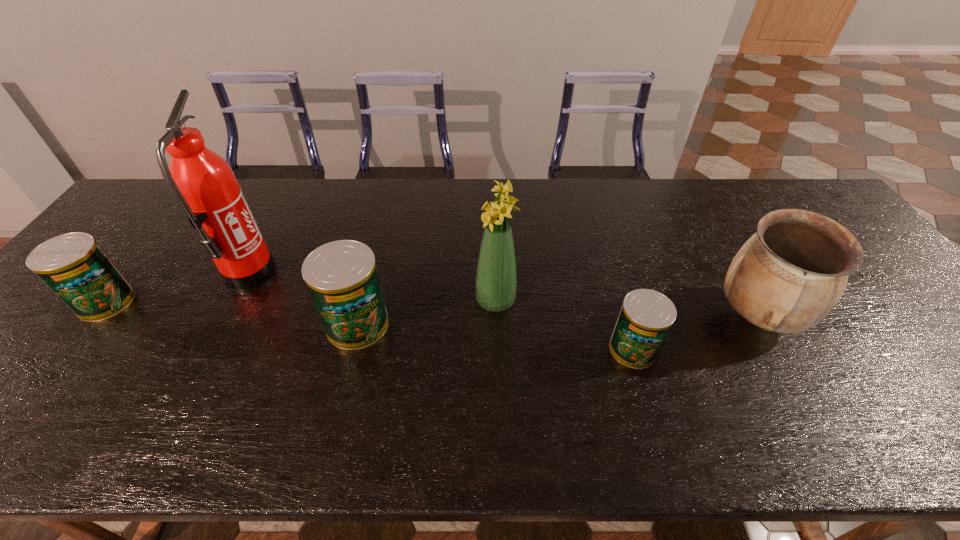
The height and width of the screenshot is (540, 960). What are the coordinates of `vacant space in between the third object from right to left and the second tallest can` in the screenshot? It's located at (301, 301).

Identify the location of free spot between the tallest object and the fifth object from left to right. Image resolution: width=960 pixels, height=540 pixels. (441, 310).

Point out which object is positioned as the nearest to the urn. Please provide its 2D coordinates. Your answer should be formatted as a tuple, i.e. [(x, y)], where the tuple contains the x and y coordinates of a point satisfying the conditions above.

[(646, 316)]

Identify which object is located as the fourth nearest to the rightmost can. Please provide its 2D coordinates. Your answer should be formatted as a tuple, i.e. [(x, y)], where the tuple contains the x and y coordinates of a point satisfying the conditions above.

[(203, 183)]

At what (x,y) coordinates should I click in order to perform the action: click on can that is the third closest to the fourth shortest object. Please return your answer as a coordinate pair (x, y). Image resolution: width=960 pixels, height=540 pixels. Looking at the image, I should click on (76, 269).

I want to click on can that is the nearest to the second shortest can, so click(x=342, y=278).

The width and height of the screenshot is (960, 540). What are the coordinates of `free spot that satisfies the following two spatial constraints: 1. on the label side of the fifth object from right to left; 2. on the front side of the leftmost object` in the screenshot? It's located at (232, 302).

Where is `free space in the image that satisfies the following two spatial constraints: 1. on the label side of the fourth object from right to left; 2. on the right side of the fire extinguisher`? free space in the image that satisfies the following two spatial constraints: 1. on the label side of the fourth object from right to left; 2. on the right side of the fire extinguisher is located at coordinates (221, 325).

Identify the location of free space that satisfies the following two spatial constraints: 1. on the back side of the fourth shortest object; 2. on the front-facing side of the bouquet. Image resolution: width=960 pixels, height=540 pixels. (750, 301).

Where is `free region that satisfies the following two spatial constraints: 1. on the front-facing side of the rightmost object; 2. on the right side of the bouquet`? This screenshot has height=540, width=960. free region that satisfies the following two spatial constraints: 1. on the front-facing side of the rightmost object; 2. on the right side of the bouquet is located at coordinates (496, 315).